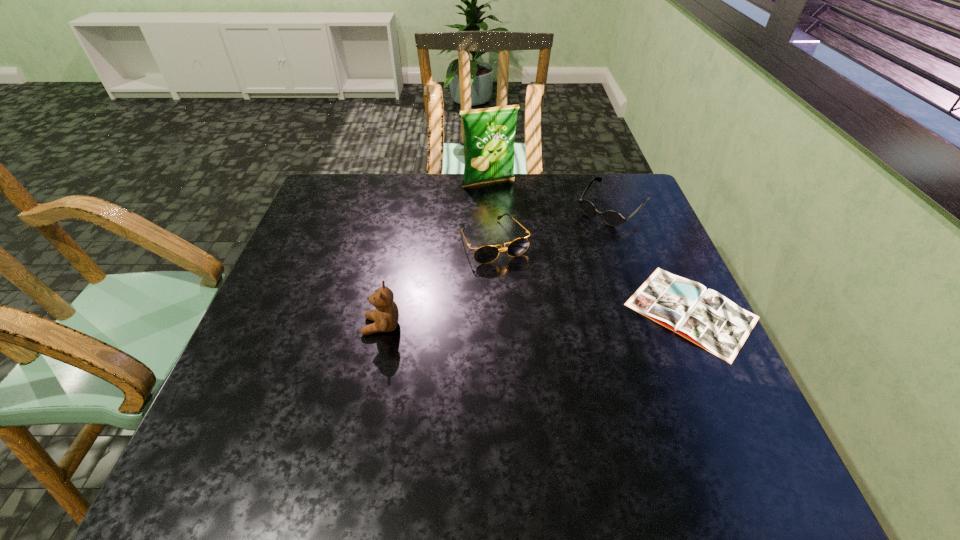
Identify the location of vacant point located between the right sunglasses and the left sunglasses. (553, 224).

You are a GUI agent. You are given a task and a screenshot of the screen. Output one action in this format:
    pyautogui.click(x=<x>, y=<y>)
    Task: Click on the object that can be found as the closest to the tallest object
    
    Given the screenshot: What is the action you would take?
    pyautogui.click(x=485, y=254)

Identify the location of object that is the third closest to the tallest object. The width and height of the screenshot is (960, 540). (705, 317).